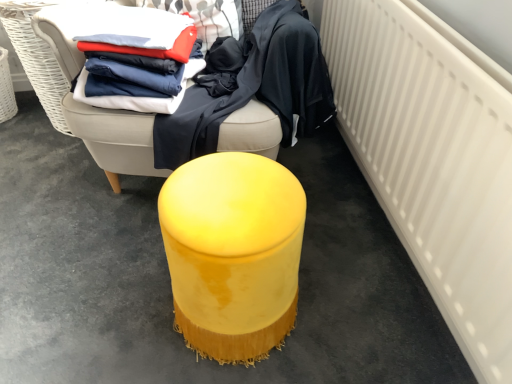
Question: From a real-world perspective, is matte cotton shirts at upper left, placed as the first clothing when sorted from left to right, physically located above or below matte blue fabric at center, the 1th clothing from the right?

Choices:
 (A) below
 (B) above

Answer: (B)

Question: Looking at their shapes, would you say matte cotton shirts at upper left, placed as the first clothing when sorted from left to right, is wider or thinner than matte blue fabric at center, the 1th clothing from the right?

Choices:
 (A) thin
 (B) wide

Answer: (A)

Question: Estimate the real-world distances between objects in this image. Which object is farther from the white matte radiator at right?

Choices:
 (A) velvet yellow ottoman at center, placed as the 1th furniture when sorted from bottom to top
 (B) velvet yellow ottoman at center, positioned as the first furniture in top-to-bottom order
 (C) matte blue fabric at center, which is counted as the 2th clothing, starting from the left
 (D) matte cotton shirts at upper left, placed as the first clothing when sorted from left to right

Answer: (D)

Question: Which of these objects is positioned closest to the matte blue fabric at center, the 1th clothing from the right?

Choices:
 (A) velvet yellow ottoman at center, which ranks as the second furniture in bottom-to-top order
 (B) white matte radiator at right
 (C) matte cotton shirts at upper left, arranged as the second clothing when viewed from the right
 (D) velvet yellow ottoman at center, the second furniture when ordered from top to bottom

Answer: (A)